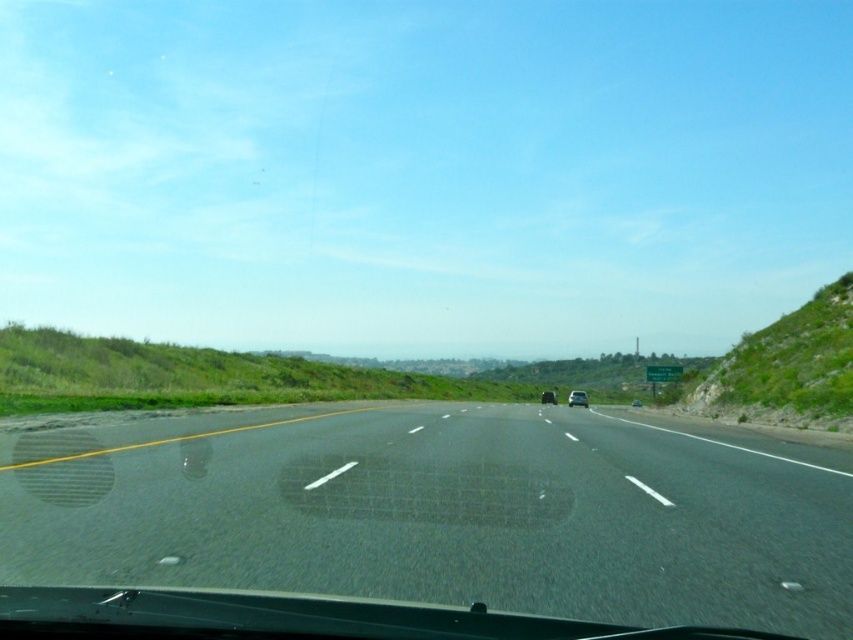
Question: Which point is closer to the camera taking this photo?

Choices:
 (A) (573, 404)
 (B) (550, 396)

Answer: (A)

Question: Based on their relative distances, which object is farther from the black asphalt highway at center?

Choices:
 (A) shiny silver sedan at center
 (B) silver metallic sedan at center
 (C) green grassy hillside at right

Answer: (A)

Question: Which point is closer to the camera?

Choices:
 (A) (567, 401)
 (B) (544, 401)
 (C) (751, 364)
 (D) (798, 540)

Answer: (D)

Question: Does black asphalt highway at center appear over shiny silver sedan at center?

Choices:
 (A) no
 (B) yes

Answer: (B)

Question: Can you confirm if black asphalt highway at center is positioned above silver metallic sedan at center?

Choices:
 (A) yes
 (B) no

Answer: (A)

Question: Does silver metallic sedan at center have a smaller size compared to shiny silver sedan at center?

Choices:
 (A) no
 (B) yes

Answer: (A)